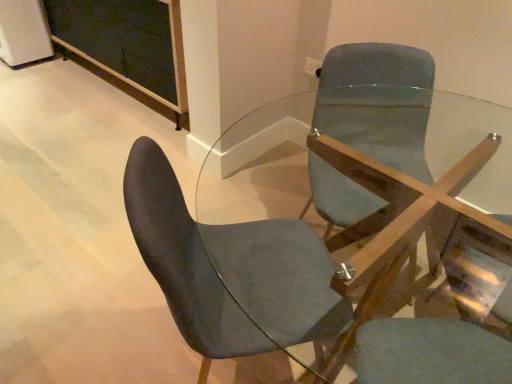
I want to click on free space to the left of velvet dark blue chair at center, so click(x=108, y=323).